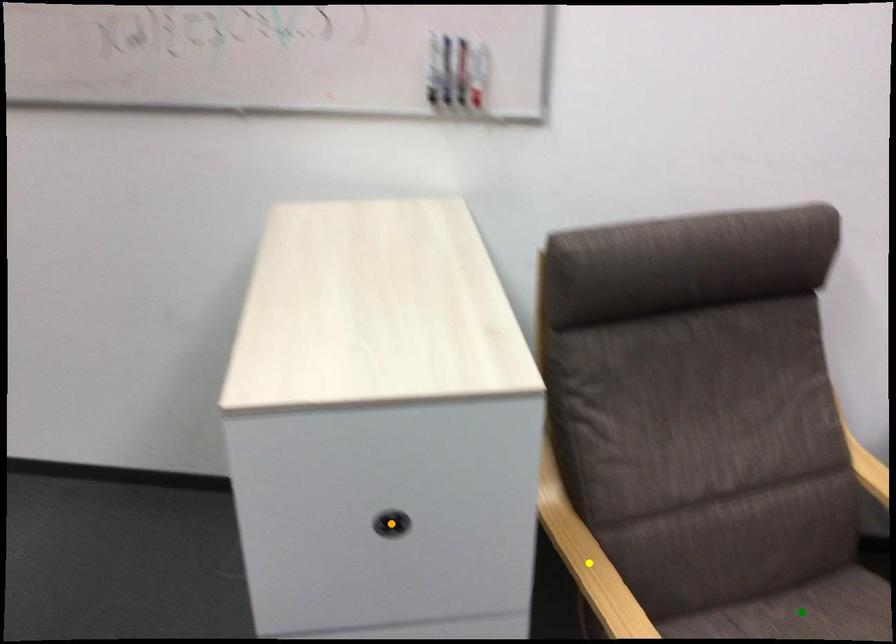
Order these from nearest to farthest:
1. orange point
2. yellow point
3. green point

green point, yellow point, orange point